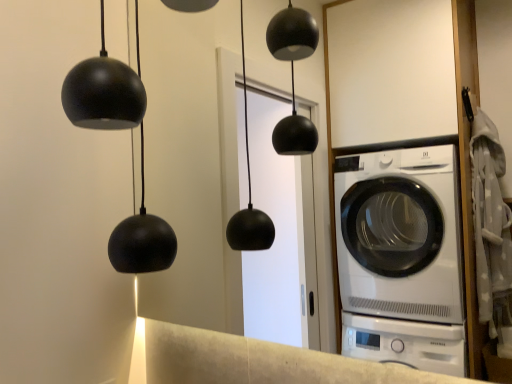
Describe the element at coordinates (120, 129) in the screenshot. I see `matte black chandelier at upper left` at that location.

The height and width of the screenshot is (384, 512). What are the coordinates of `matte black chandelier at upper left` in the screenshot? It's located at (120, 129).

In order to click on matte black chandelier at upper left in this screenshot , I will do `click(120, 129)`.